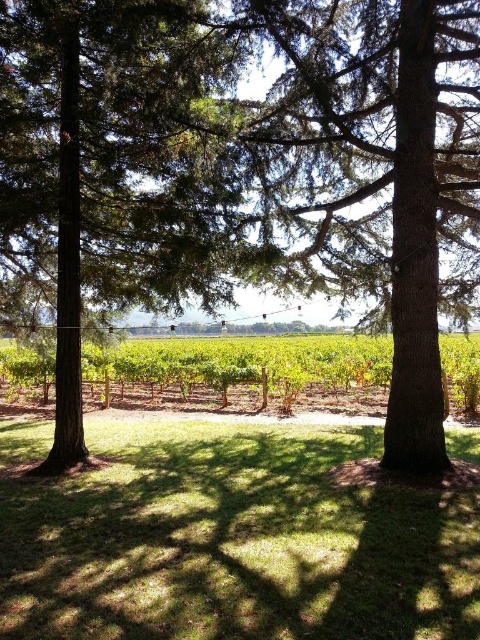
This screenshot has width=480, height=640. What do you see at coordinates (233, 541) in the screenshot?
I see `green grass at center` at bounding box center [233, 541].

Is green grass at center bigger than green textured tree at center?

No, green grass at center is not bigger than green textured tree at center.

Is point (272, 483) farther from viewer compared to point (22, 90)?

No, (272, 483) is in front of (22, 90).

What are the coordinates of `green grass at center` in the screenshot? It's located at (233, 541).